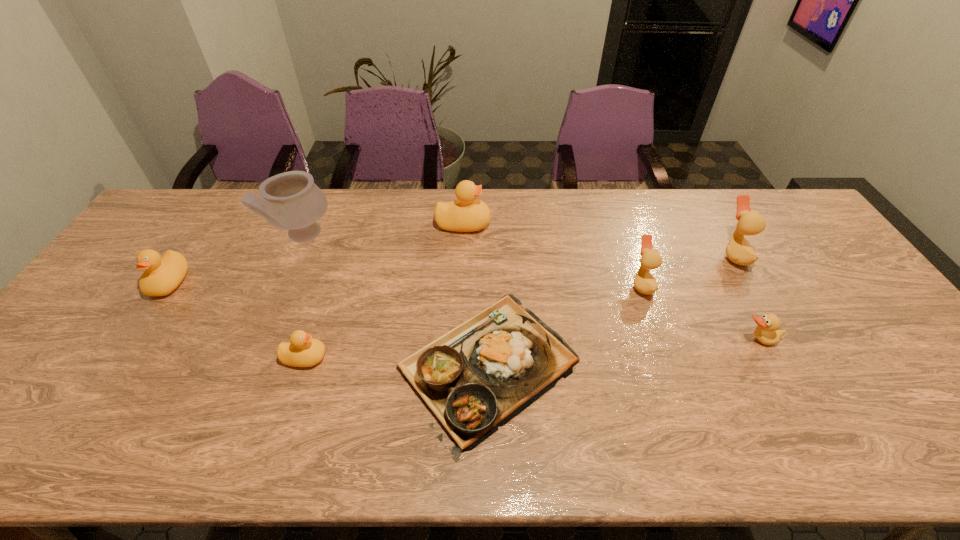
The height and width of the screenshot is (540, 960). I want to click on the second yellow duck from left to right, so click(302, 351).

Locate an element on the screen. The width and height of the screenshot is (960, 540). the smallest tan duck is located at coordinates (767, 332).

I want to click on the shortest object, so tap(476, 377).

Where is `vacant region located on the back of the tallest object`? The height and width of the screenshot is (540, 960). vacant region located on the back of the tallest object is located at coordinates (320, 195).

Identify the location of free point located 0.220m on the face of the biggest yellow duck. The height and width of the screenshot is (540, 960). (557, 224).

This screenshot has width=960, height=540. I want to click on free region located on the beak of the biggest tan duck, so click(x=646, y=255).

Image resolution: width=960 pixels, height=540 pixels. What are the coordinates of `free region located 0.290m on the beak of the biggest tan duck` in the screenshot? It's located at (627, 255).

Image resolution: width=960 pixels, height=540 pixels. I want to click on vacant space located on the beak of the biggest tan duck, so click(601, 255).

This screenshot has width=960, height=540. What are the coordinates of `free space located on the face of the second farthest yellow duck` in the screenshot? It's located at pos(129,342).

This screenshot has width=960, height=540. What are the coordinates of `vacant region located on the beak of the second smallest tan duck` in the screenshot? It's located at (579, 285).